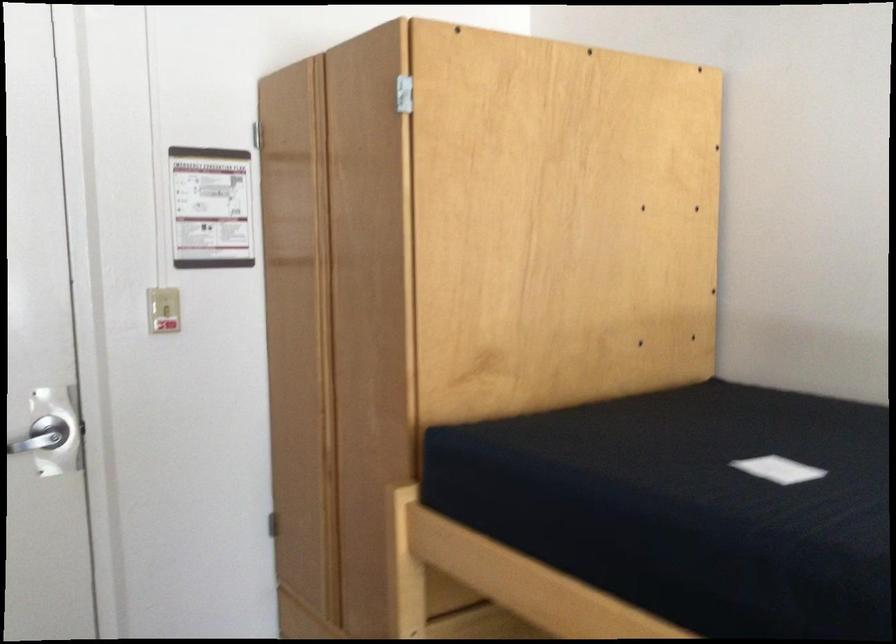
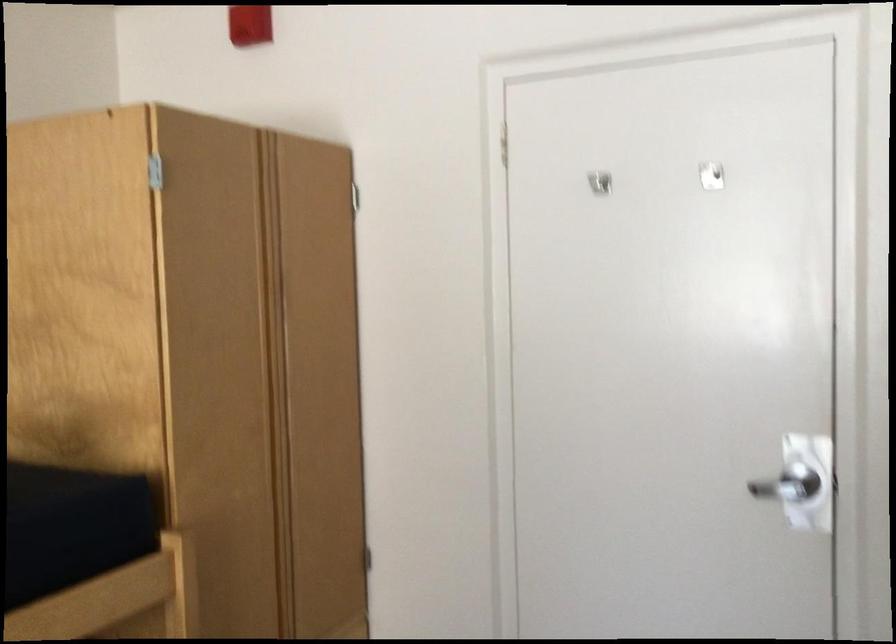
Question: The first image is from the beginning of the video and the second image is from the end. How did the camera likely rotate when shooting the video?

Choices:
 (A) Left
 (B) Right
 (C) Up
 (D) Down

Answer: (A)